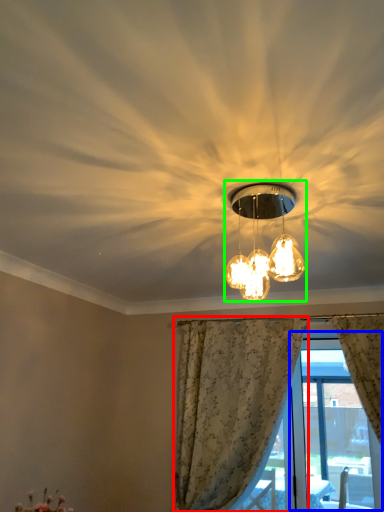
Question: Considering the real-world distances, which object is closest to curtain (highlighted by a red box)? window screen (highlighted by a blue box) or lamp (highlighted by a green box).

Choices:
 (A) window screen
 (B) lamp

Answer: (A)